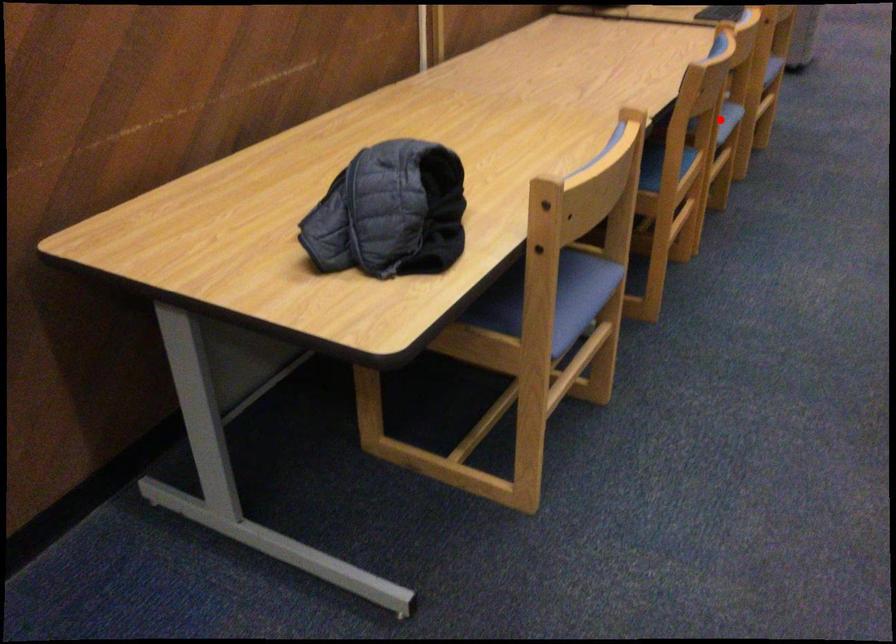
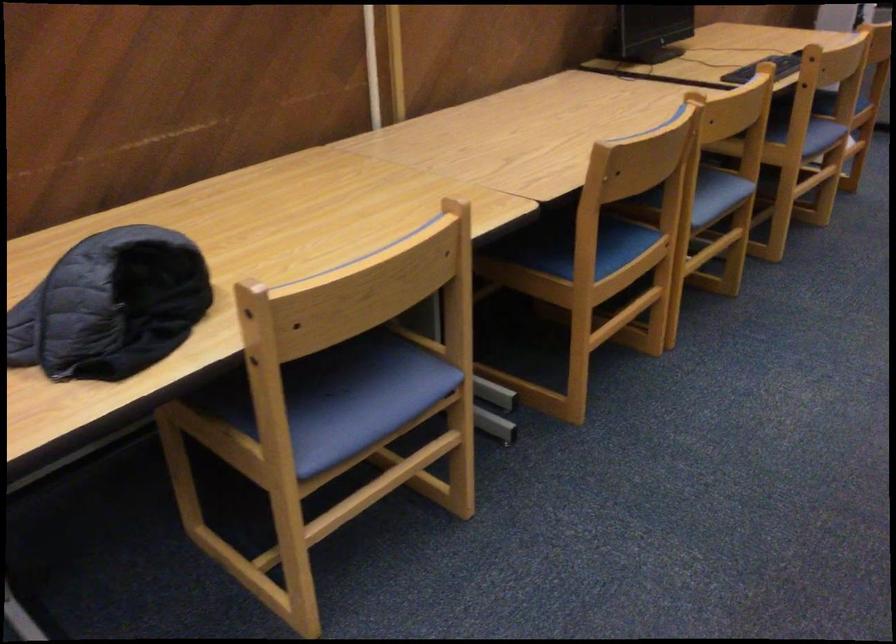
Where in the second image is the point corresponding to the highlighted location from the first image?

(718, 194)